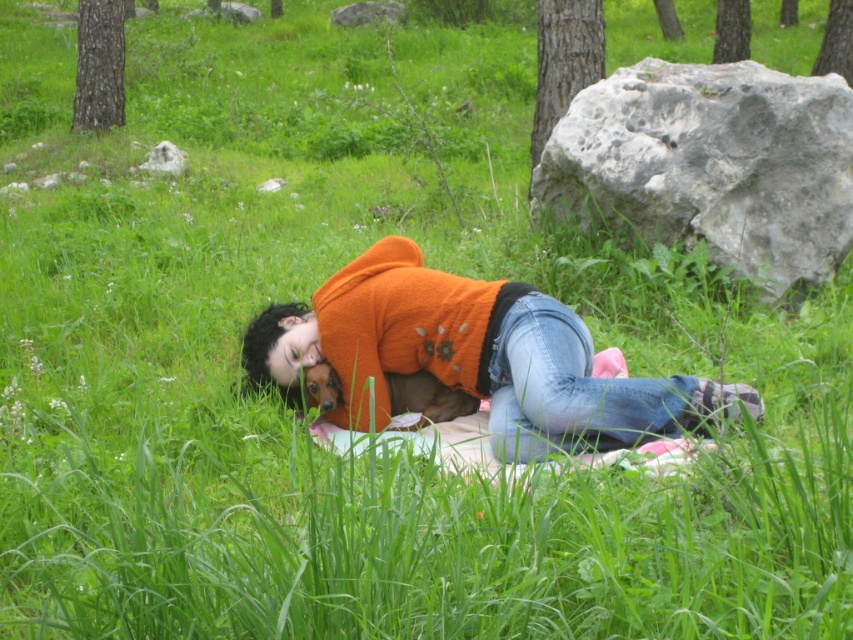
Can you confirm if gray rough rock at upper right is positioned above gray rough rock at upper center?

Incorrect, gray rough rock at upper right is not positioned above gray rough rock at upper center.

Can you confirm if gray rough rock at upper right is shorter than gray rough rock at upper center?

No.

Image resolution: width=853 pixels, height=640 pixels. What are the coordinates of `gray rough rock at upper right` in the screenshot? It's located at (711, 164).

In order to click on gray rough rock at upper right in this screenshot , I will do `click(711, 164)`.

Can you confirm if orange fleece sweater at center is bigger than gray rough rock at upper center?

Yes.

From the picture: Does orange fleece sweater at center have a greater width compared to gray rough rock at upper center?

Yes.

Identify the location of orange fleece sweater at center. (474, 356).

Can you confirm if gray rough rock at upper right is positioned to the right of orange fleece sweater at center?

Indeed, gray rough rock at upper right is positioned on the right side of orange fleece sweater at center.

Is point (850, 170) in front of point (520, 413)?

No, it is behind (520, 413).

This screenshot has height=640, width=853. What do you see at coordinates (711, 164) in the screenshot?
I see `gray rough rock at upper right` at bounding box center [711, 164].

This screenshot has width=853, height=640. Identify the location of gray rough rock at upper right. (711, 164).